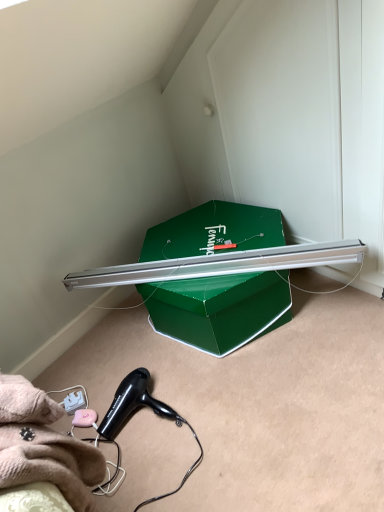
Locate an element on the screen. free space behind black plastic hair dryer at lower left is located at coordinates (155, 361).